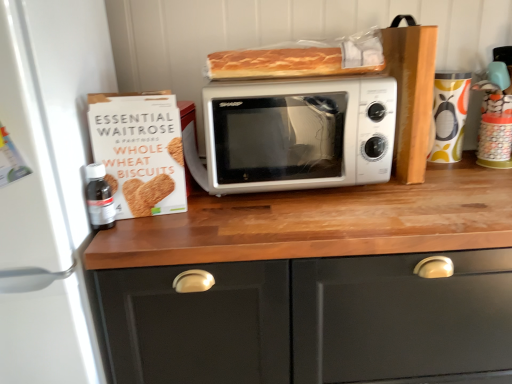
Locate an element on the screen. vacant region in front of transparent plastic bottle at left is located at coordinates (111, 244).